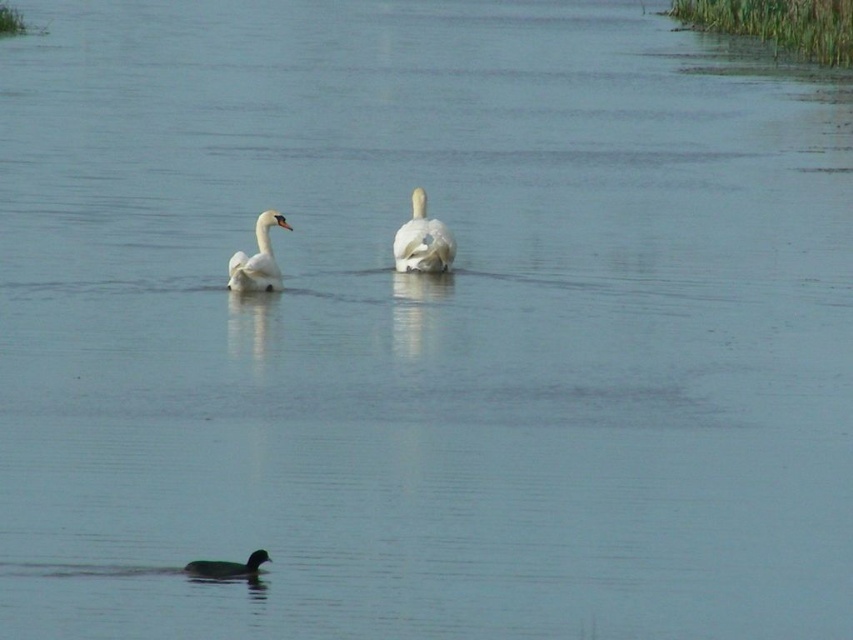
Question: In this image, where is white glossy swan at center located relative to dark brown matte duck at lower center?

Choices:
 (A) right
 (B) left

Answer: (A)

Question: Which point appears farthest from the camera in this image?

Choices:
 (A) (263, 237)
 (B) (426, 264)
 (C) (209, 568)

Answer: (B)

Question: Among these points, which one is farthest from the camera?

Choices:
 (A) (415, 252)
 (B) (264, 561)
 (C) (251, 257)

Answer: (A)

Question: Which point appears closest to the camera in this image?

Choices:
 (A) [207, 566]
 (B) [270, 259]
 (C) [408, 241]

Answer: (A)

Question: Can you confirm if white glossy swan at center is positioned above white feathered swan at center?

Choices:
 (A) no
 (B) yes

Answer: (B)

Question: Can you confirm if white glossy swan at center is smaller than dark brown matte duck at lower center?

Choices:
 (A) yes
 (B) no

Answer: (B)